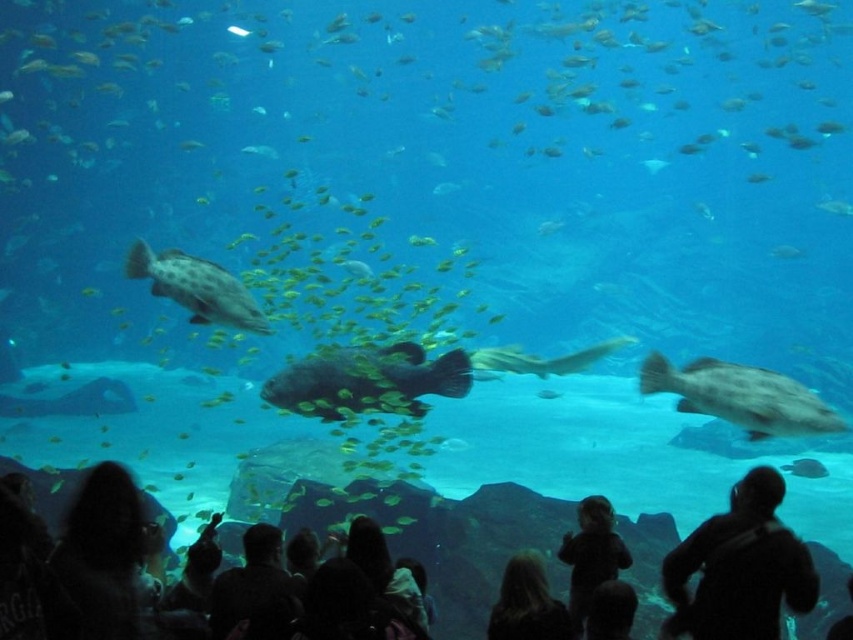
Question: Considering the relative positions of black matte wetsuit at lower right and shiny black fish at center in the image provided, where is black matte wetsuit at lower right located with respect to shiny black fish at center?

Choices:
 (A) left
 (B) right

Answer: (B)

Question: Based on their relative distances, which object is nearer to the speckled gray fish at center?

Choices:
 (A) black matte crowd at lower center
 (B) blonde hair at lower center

Answer: (B)

Question: Is black matte wetsuit at lower right to the left of dark clothing at lower center from the viewer's perspective?

Choices:
 (A) no
 (B) yes

Answer: (A)

Question: Which object appears farthest from the camera in this image?

Choices:
 (A) dark clothing at lower center
 (B) smooth silver shark at center

Answer: (B)

Question: Can you confirm if black matte wetsuit at lower right is positioned below shiny black fish at center?

Choices:
 (A) yes
 (B) no

Answer: (A)

Question: Which point is farther to the camera?

Choices:
 (A) smooth silver shark at center
 (B) smooth gray fish at center

Answer: (B)